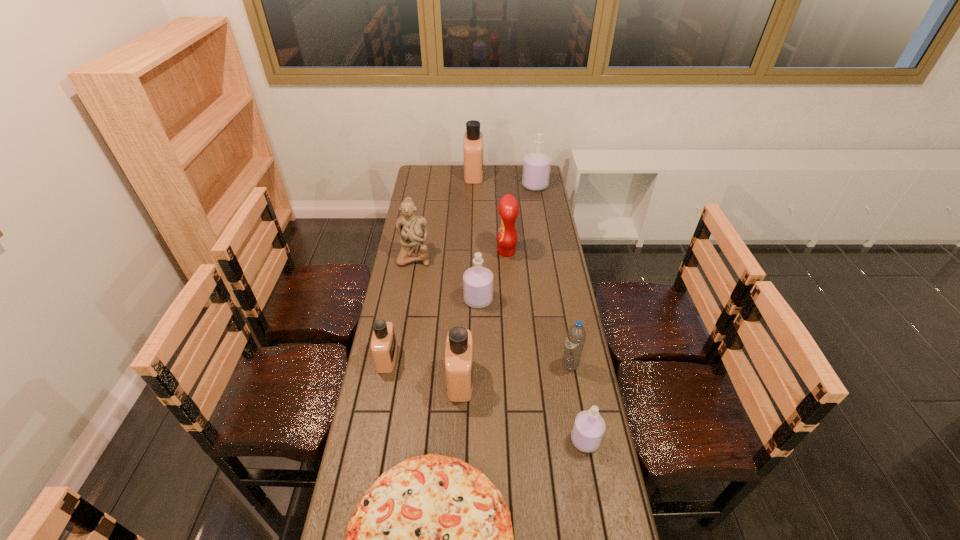
I want to click on free space that satisfies the following two spatial constraints: 1. on the back side of the biggest purple perfume; 2. on the front label of the biggest beige perfume, so click(x=533, y=174).

Locate an element on the screen. The image size is (960, 540). vacant space that satisfies the following two spatial constraints: 1. on the front label of the smallest purple perfume; 2. on the left side of the second smallest beige perfume is located at coordinates (458, 440).